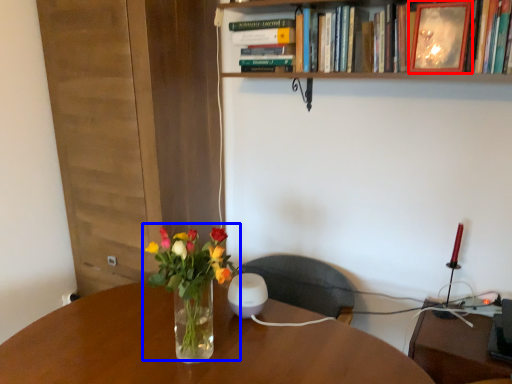
Question: Which of the following is the farthest to the observer, picture frame (highlighted by a red box) or floral arrangement (highlighted by a blue box)?

Choices:
 (A) picture frame
 (B) floral arrangement

Answer: (A)